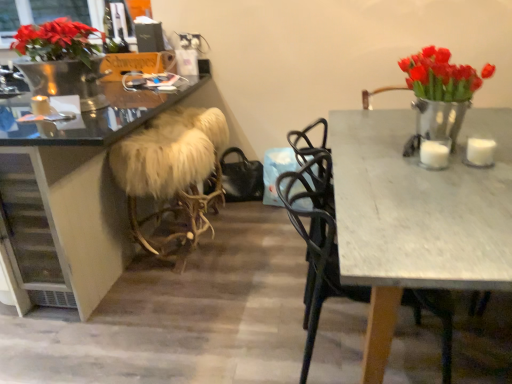
The width and height of the screenshot is (512, 384). Find the location of `vacant area that is situated to the right of white matte candle at right, marked as the first candle in a front-to-back arrangement`. vacant area that is situated to the right of white matte candle at right, marked as the first candle in a front-to-back arrangement is located at coordinates pos(474,160).